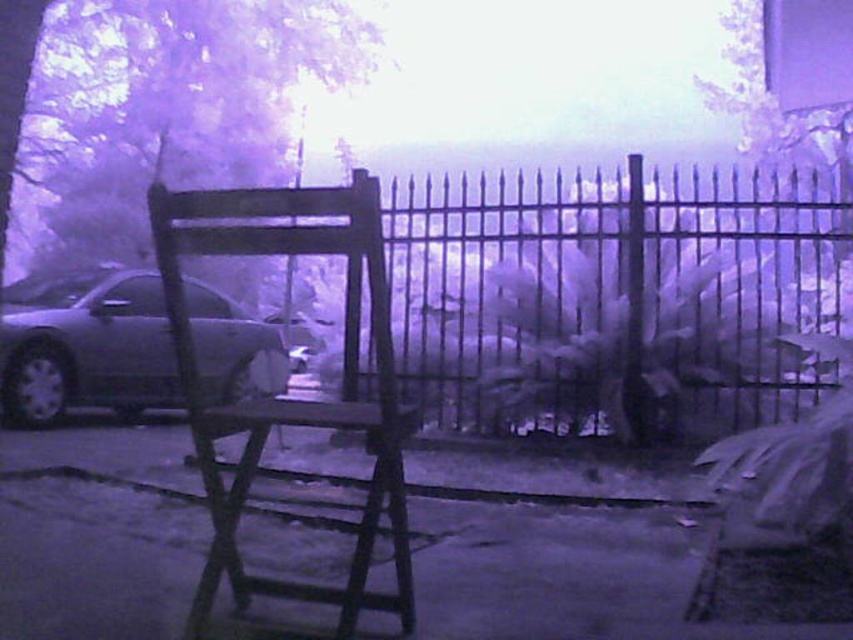
Which is more to the left, purple frosted tree at upper left or satin silver car at left?

From the viewer's perspective, satin silver car at left appears more on the left side.

Does purple frosted tree at upper left have a smaller size compared to satin silver car at left?

No, purple frosted tree at upper left is not smaller than satin silver car at left.

You are a GUI agent. You are given a task and a screenshot of the screen. Output one action in this format:
    pyautogui.click(x=<x>, y=<y>)
    Task: Click on the purple frosted tree at upper left
    The image size is (853, 640).
    Given the screenshot: What is the action you would take?
    pyautogui.click(x=195, y=108)

Where is `black metal fence at center`? black metal fence at center is located at coordinates (613, 298).

Who is more distant from viewer, (705, 200) or (91, 380)?

Positioned behind is point (91, 380).

Who is more forward, (804, 200) or (213, 307)?

Point (804, 200) is more forward.

Identify the location of black metal fence at center. (613, 298).

Can you confirm if wooden chair at center is wider than satin silver car at left?

Incorrect, wooden chair at center's width does not surpass satin silver car at left's.

Does wooden chair at center appear on the right side of satin silver car at left?

Indeed, wooden chair at center is positioned on the right side of satin silver car at left.

The height and width of the screenshot is (640, 853). What do you see at coordinates (285, 397) in the screenshot? I see `wooden chair at center` at bounding box center [285, 397].

Find the location of a particular element. This screenshot has height=640, width=853. wooden chair at center is located at coordinates (285, 397).